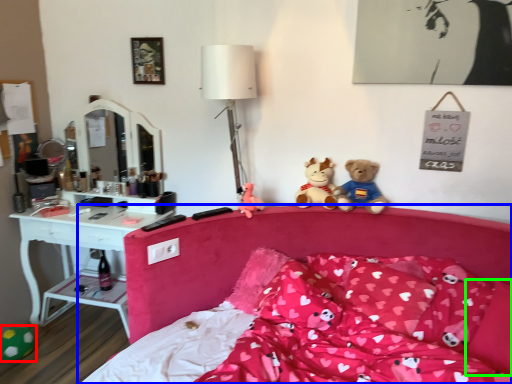
Question: Which object is the farthest from toy (highlighted by a red box)? Choose among these: bed (highlighted by a blue box) or pillow (highlighted by a green box).

Choices:
 (A) bed
 (B) pillow

Answer: (B)